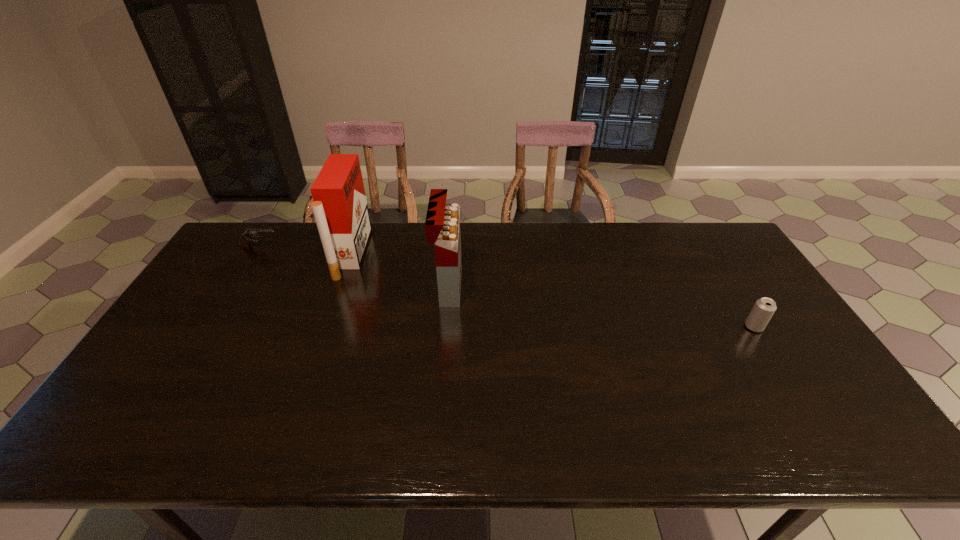
This screenshot has height=540, width=960. What are the coordinates of `free space at the near right corner of the desktop` in the screenshot? It's located at (834, 441).

You are a GUI agent. You are given a task and a screenshot of the screen. Output one action in this format:
    pyautogui.click(x=<x>, y=<y>)
    Task: Click on the vacant point located between the beer can and the right cigarette case
    
    Given the screenshot: What is the action you would take?
    pyautogui.click(x=601, y=307)

Locate an element on the screen. The image size is (960, 540). vacant region between the third object from right to left and the right cigarette case is located at coordinates (399, 270).

Image resolution: width=960 pixels, height=540 pixels. I want to click on free area in between the second shortest object and the third object from left to right, so click(x=601, y=307).

The width and height of the screenshot is (960, 540). I want to click on empty space between the third tallest object and the left cigarette case, so click(x=553, y=290).

In order to click on empty location between the left cigarette case and the second object from right to left in this screenshot , I will do `click(399, 270)`.

Identify the location of unoccupied position between the second object from left to right and the pistol. This screenshot has height=540, width=960. (306, 251).

Where is `blank region between the second object from right to left and the beer can`? blank region between the second object from right to left and the beer can is located at coordinates (601, 307).

Where is `free space between the nearest object and the leftmost object`? free space between the nearest object and the leftmost object is located at coordinates (507, 287).

Find the location of `vacant area between the beer can and the third object from left to right`. vacant area between the beer can and the third object from left to right is located at coordinates (601, 307).